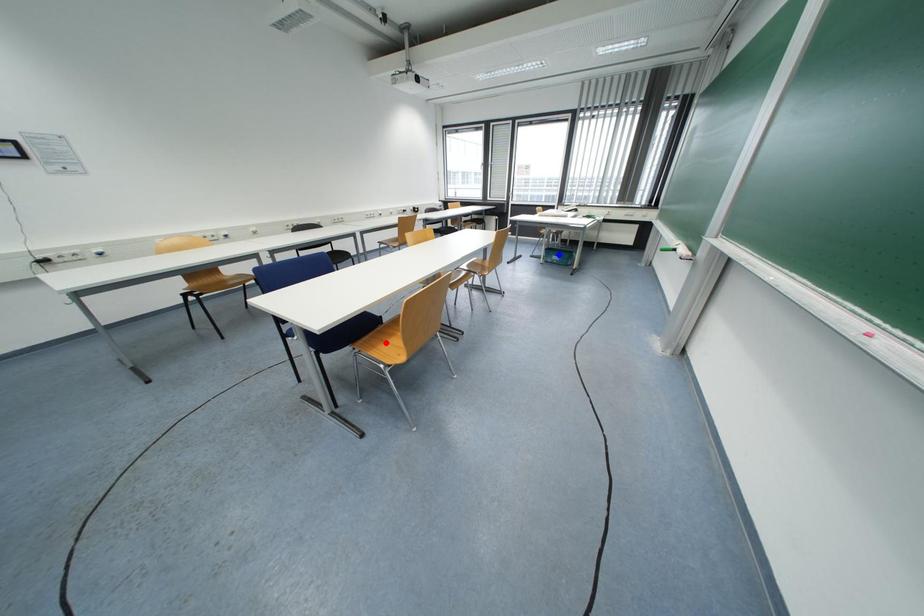
Question: Which of the two points in the image is closer to the camera?

Choices:
 (A) Blue point is closer.
 (B) Red point is closer.

Answer: (B)